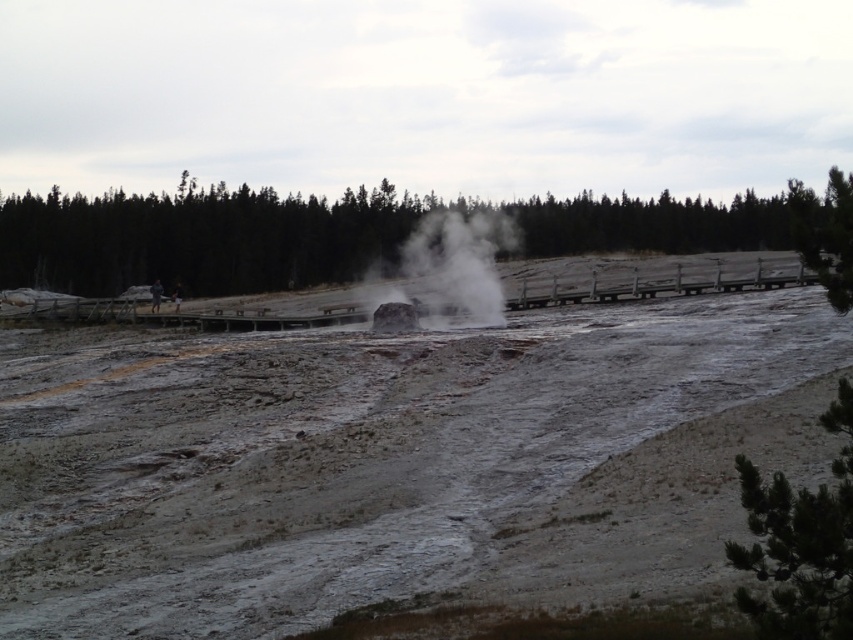
Question: In this image, where is green leafy tree at upper center located relative to green pine tree at lower right?

Choices:
 (A) right
 (B) left

Answer: (B)

Question: Is green leafy tree at upper center above green pine tree at lower right?

Choices:
 (A) no
 (B) yes

Answer: (B)

Question: Which of the following is the farthest from the observer?

Choices:
 (A) (784, 506)
 (B) (428, 225)
 (C) (413, 403)

Answer: (B)

Question: Which object appears farthest from the camera in this image?

Choices:
 (A) green leafy tree at upper center
 (B) white vapor at center
 (C) steamy mud at center

Answer: (B)

Question: Which point is closer to the camera?

Choices:
 (A) (372, 225)
 (B) (210, 614)
 (C) (442, 225)

Answer: (B)

Question: Is steamy mud at center above green leafy tree at upper center?

Choices:
 (A) no
 (B) yes

Answer: (A)